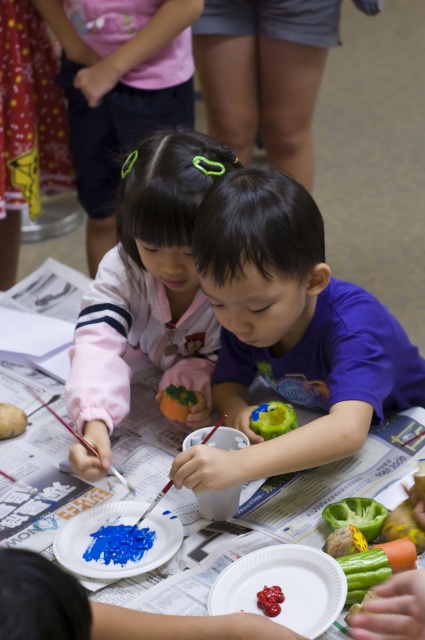
Does point (346, 577) come in front of point (263, 600)?

No, it is not.

This screenshot has height=640, width=425. I want to click on green matte bell pepper at lower right, so pos(376,564).

Where is `green matte bell pepper at lower right`? The height and width of the screenshot is (640, 425). green matte bell pepper at lower right is located at coordinates (376, 564).

Who is taller, blue matte paper plate at center or green matte bell pepper at lower right?

Standing taller between the two is green matte bell pepper at lower right.

What are the coordinates of `blue matte paper plate at center` in the screenshot? It's located at (116, 540).

Find the location of a particular element. This screenshot has height=640, width=425. blue matte paper plate at center is located at coordinates (116, 540).

Which is more to the right, pink fabric hair tie at upper center or smooth brown potato at lower left?

Positioned to the right is pink fabric hair tie at upper center.

Looking at this image, does pink fabric hair tie at upper center appear over smooth brown potato at lower left?

Yes, pink fabric hair tie at upper center is above smooth brown potato at lower left.

The width and height of the screenshot is (425, 640). I want to click on pink fabric hair tie at upper center, so click(x=113, y=104).